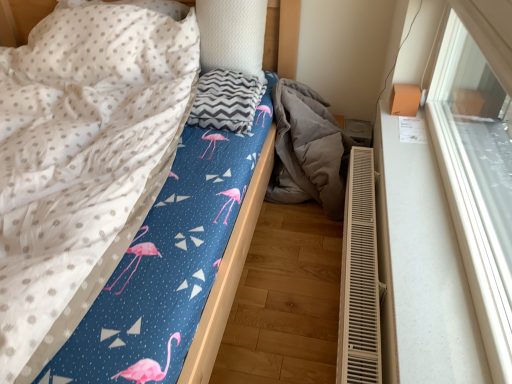
Find the location of `free point below white glossy window sill at upper right (from a real-world perspective)`. free point below white glossy window sill at upper right (from a real-world perspective) is located at coordinates click(436, 224).